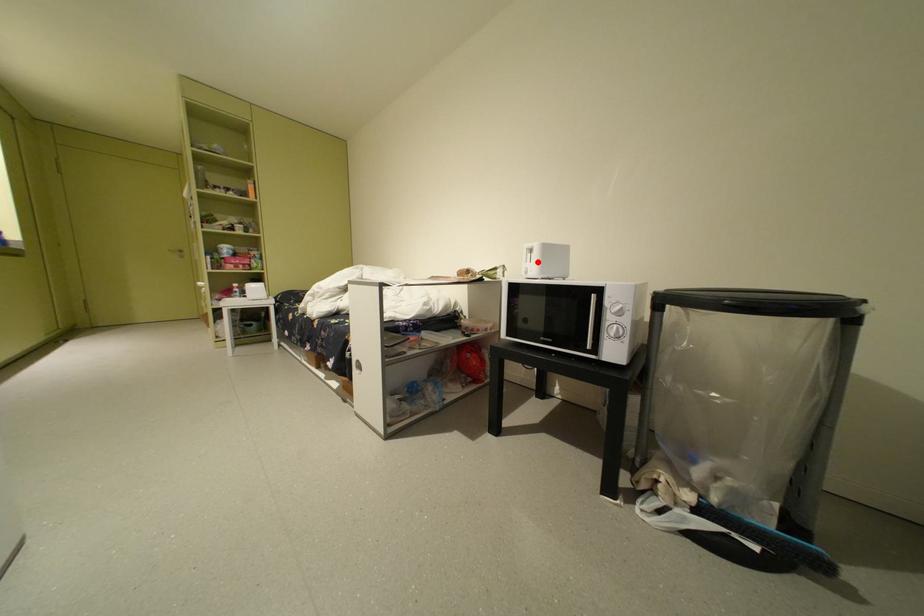
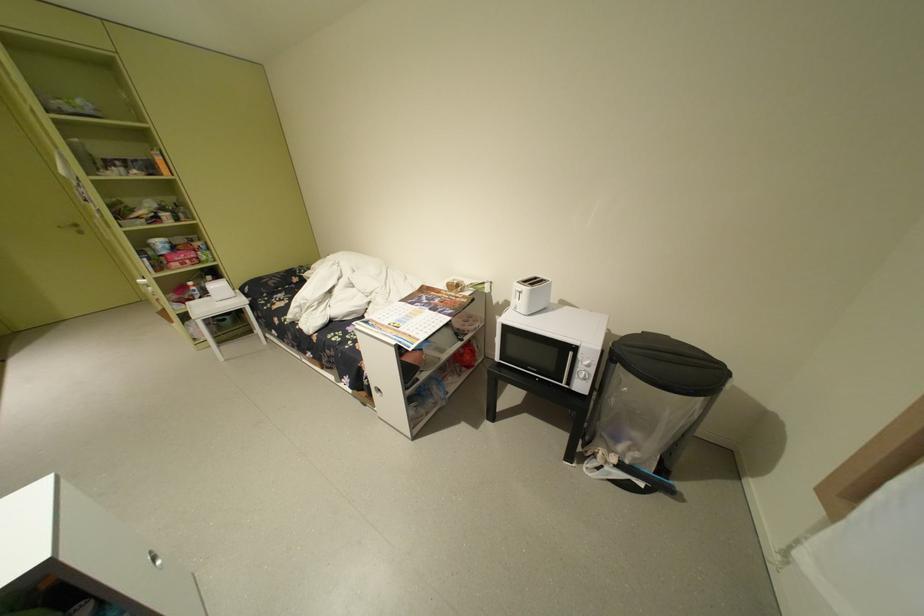
Question: I am providing you with two images of the same scene from different viewpoints. A red point is shown in image1. For the corresponding object point in image2, is it positioned nearer or farther from the camera?

Choices:
 (A) Nearer
 (B) Farther

Answer: (A)